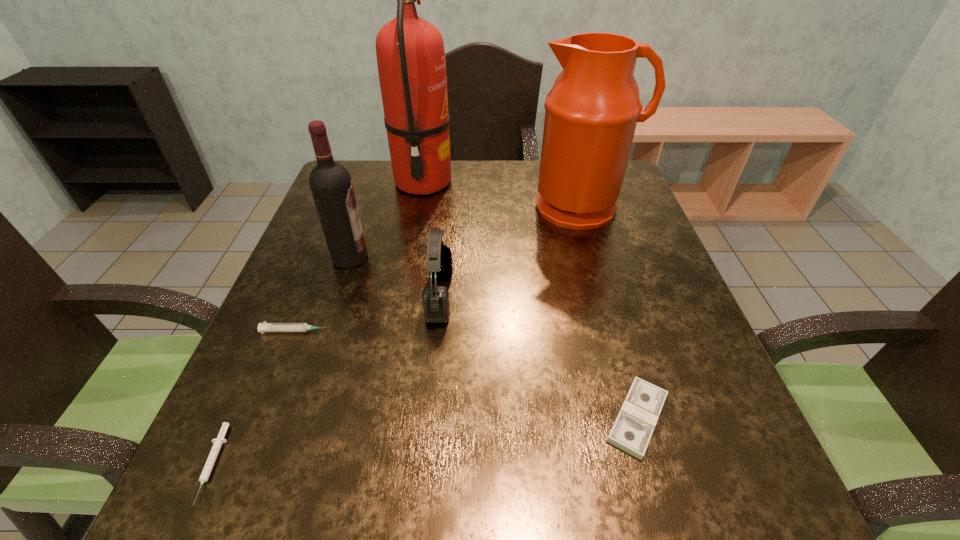
This screenshot has width=960, height=540. Find the location of `dollar that is at the right edge`. dollar that is at the right edge is located at coordinates (632, 430).

Where is `object located in the near left corner section of the desktop`? object located in the near left corner section of the desktop is located at coordinates (218, 442).

The width and height of the screenshot is (960, 540). Find the location of `object present at the far right corner`. object present at the far right corner is located at coordinates (591, 112).

In the image, there is a desktop. Identify the location of free space at the far edge. (493, 191).

The height and width of the screenshot is (540, 960). In the image, there is a desktop. What are the coordinates of `vacant space at the near edge` in the screenshot? It's located at (362, 496).

In the image, there is a desktop. Where is `vacant space at the left edge`? vacant space at the left edge is located at coordinates (309, 231).

This screenshot has height=540, width=960. I want to click on free space at the right edge, so click(x=642, y=322).

What are the coordinates of `unoccupied position between the nearer syringe and the fire extinguisher` in the screenshot? It's located at (318, 323).

This screenshot has height=540, width=960. Find the location of `free space between the nearer syringe and the third tallest object`. free space between the nearer syringe and the third tallest object is located at coordinates [280, 361].

You are a GUI agent. You are given a task and a screenshot of the screen. Output one action in this format:
    pyautogui.click(x=<x>, y=<y>)
    Task: Click on the unoccupied area between the fourth shortest object and the nearer syringe
    The width and height of the screenshot is (960, 540).
    Given the screenshot: What is the action you would take?
    pyautogui.click(x=325, y=380)